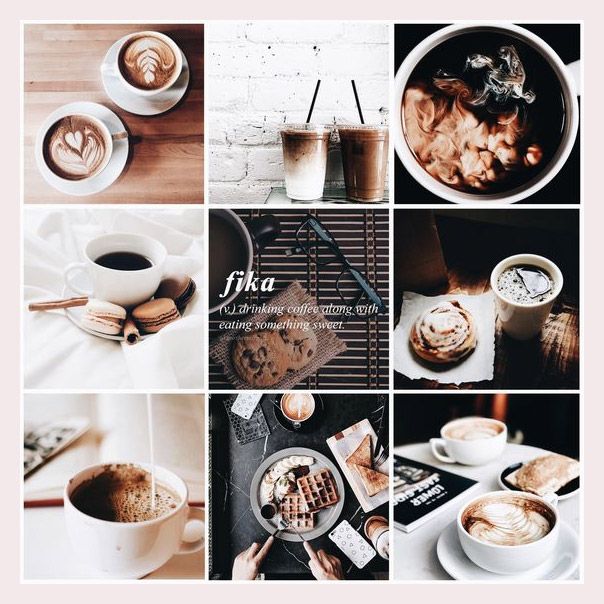
The image size is (604, 604). Identify the location of cups with handles in the image. (124, 499), (471, 437), (513, 525), (138, 254), (74, 144), (137, 60), (515, 108).